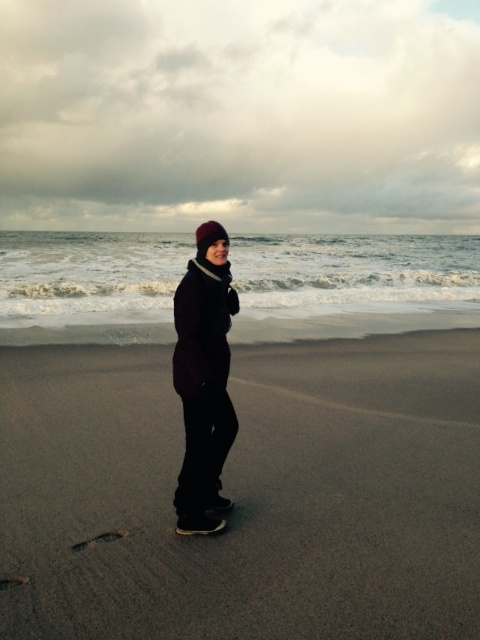
This screenshot has height=640, width=480. In order to click on dark sand at center in this screenshot , I will do `click(244, 493)`.

Can you confirm if dark sand at center is smaller than matte dark brown coat at center?

Actually, dark sand at center might be larger than matte dark brown coat at center.

Between point (85, 387) and point (197, 456), which one is positioned in front?

Point (197, 456)

Locate an element on the screen. The height and width of the screenshot is (640, 480). dark sand at center is located at coordinates (244, 493).